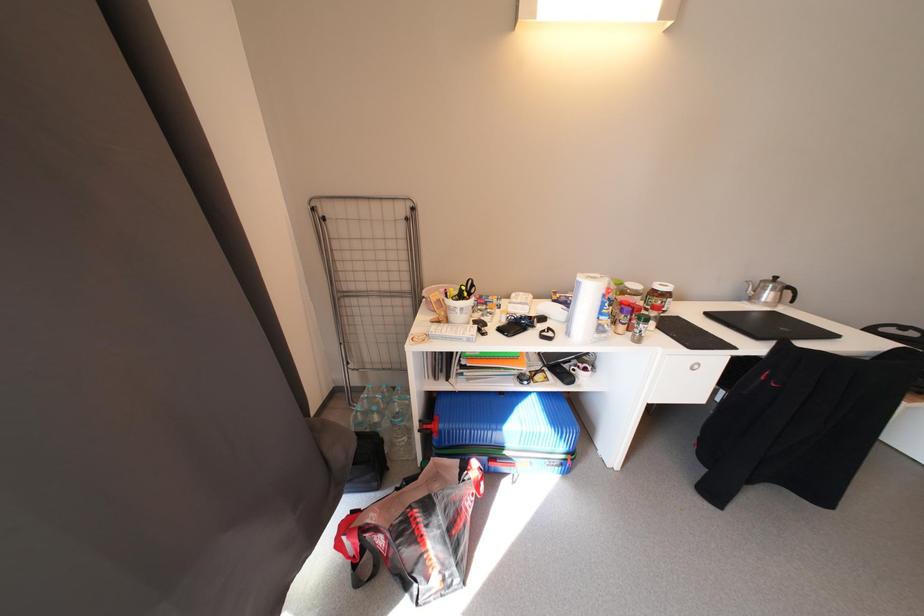
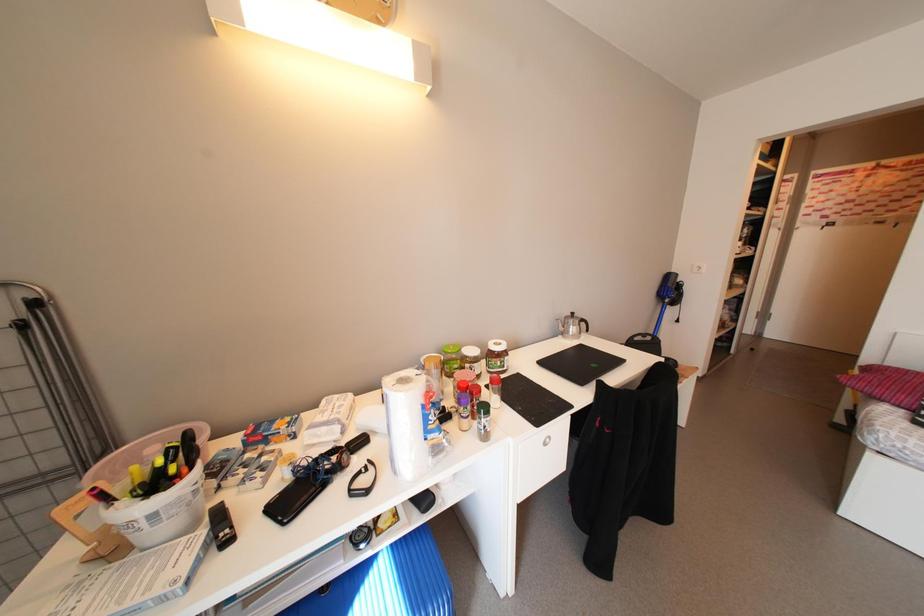
Question: The first image is from the beginning of the video and the second image is from the end. How did the camera likely rotate when shooting the video?

Choices:
 (A) Left
 (B) Right
 (C) Up
 (D) Down

Answer: (B)